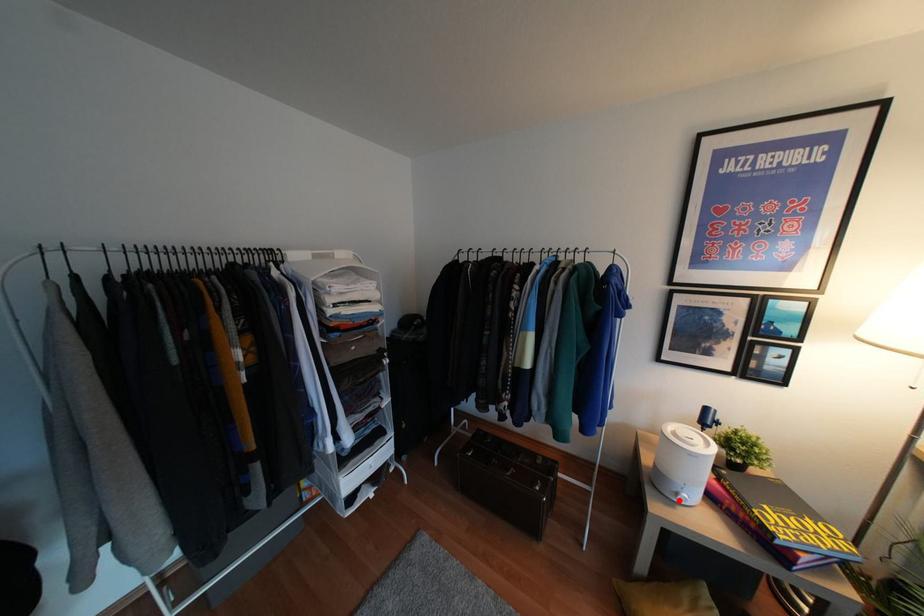
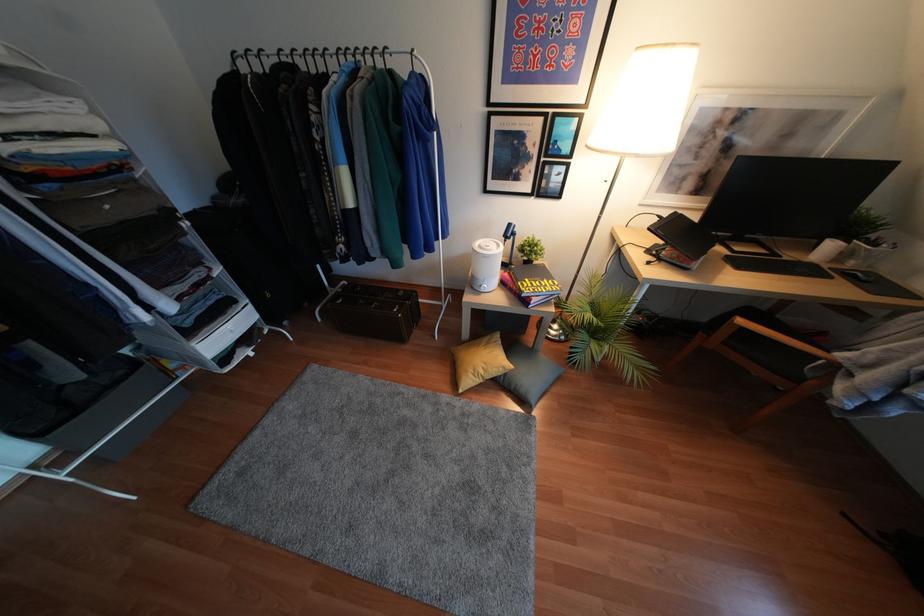
Find the pixel in the second image that matches the highlighted location in the first image.

(481, 290)